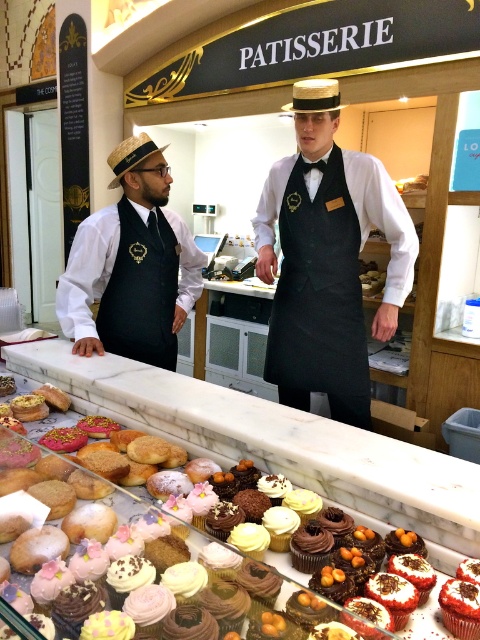
Question: Which point is closer to the camera?

Choices:
 (A) (112, 339)
 (B) (168, 176)
 (C) (283, 284)

Answer: (C)

Question: In this image, where is black matte apron at center located relative to black fabric apron at left?

Choices:
 (A) below
 (B) above

Answer: (A)

Question: Which of the following is the farthest from the observer?

Choices:
 (A) (348, 259)
 (B) (127, 252)
 (C) (146, 362)

Answer: (C)

Question: Does matte black vest at left have a lesser width compared to black fabric apron at left?

Choices:
 (A) no
 (B) yes

Answer: (A)

Question: Based on their relative distances, which object is farther from the black matte apron at center?

Choices:
 (A) matte black vest at left
 (B) black fabric apron at left

Answer: (A)

Question: Can you confirm if black matte apron at center is positioned to the left of black fabric apron at left?

Choices:
 (A) no
 (B) yes

Answer: (A)